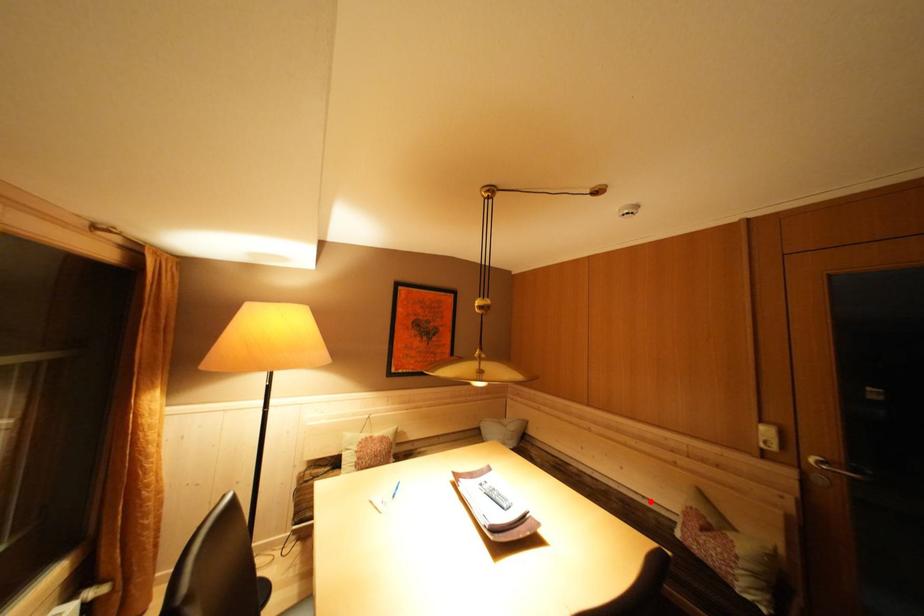
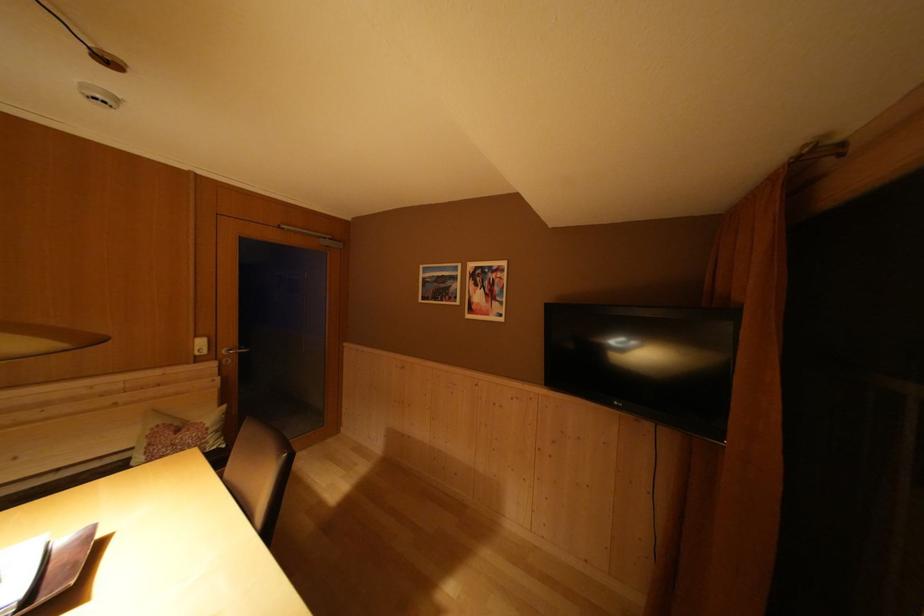
Where in the second image is the point corresponding to the highlighted location from the first image?

(66, 475)